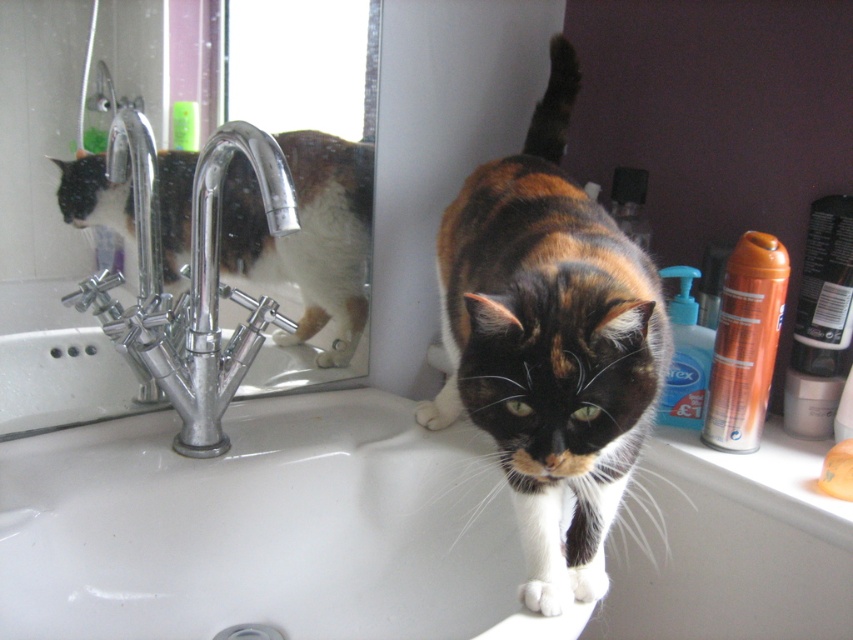
Describe the element at coordinates (55, 252) in the screenshot. I see `silver/metallic mirror at upper center` at that location.

Is silver/metallic mirror at upper center bigger than chrome metallic faucet at sink left?

Indeed, silver/metallic mirror at upper center has a larger size compared to chrome metallic faucet at sink left.

Who is more forward, (9,60) or (204,348)?

Point (9,60)

Where is `silver/metallic mirror at upper center`? silver/metallic mirror at upper center is located at coordinates (55, 252).

Consider the image. Who is positioned more to the right, silver/metallic mirror at upper center or calico fur cat at center?

From the viewer's perspective, calico fur cat at center appears more on the right side.

The height and width of the screenshot is (640, 853). Describe the element at coordinates (55, 252) in the screenshot. I see `silver/metallic mirror at upper center` at that location.

I want to click on silver/metallic mirror at upper center, so click(x=55, y=252).

Is point (334, 524) positioned before point (189, 408)?

No, (334, 524) is further to viewer.

Between point (439, 577) and point (224, 291), which one is positioned behind?

The point (224, 291) is behind.

Is point (68, 600) farther from viewer compared to point (157, 224)?

No, it is in front of (157, 224).

Find the location of a particular element. Image resolution: width=853 pixels, height=640 pixels. white glossy sink at center is located at coordinates (264, 529).